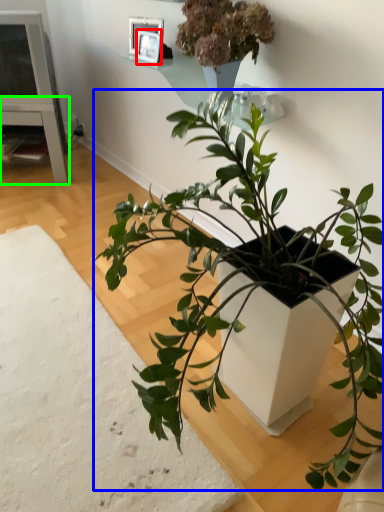
Question: Which object is the closest to the picture frame (highlighted by a red box)? Choose among these: houseplant (highlighted by a blue box) or table (highlighted by a green box).

Choices:
 (A) houseplant
 (B) table

Answer: (B)